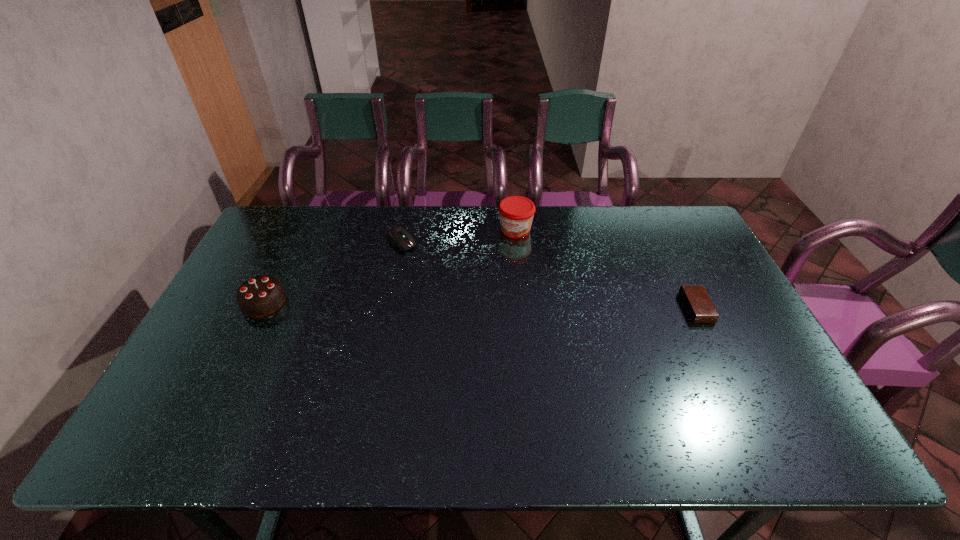
At what (x,y) coordinates should I click in order to perform the action: click on free space on the desktop that is between the leftmost object and the shortest object and is positioned on the label side of the jam. Please return your answer as a coordinate pair (x, y). This screenshot has width=960, height=540. Looking at the image, I should click on (474, 305).

Where is `vacant spot on the desktop that is between the chocolate cake and the alarm clock and is positioned on the button of the third tallest object`? vacant spot on the desktop that is between the chocolate cake and the alarm clock and is positioned on the button of the third tallest object is located at coordinates point(474,305).